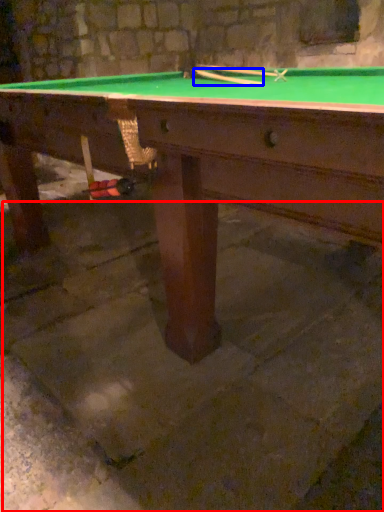
Question: Which of the following is the closest to the observer, concrete (highlighted by a red box) or cue (highlighted by a blue box)?

Choices:
 (A) concrete
 (B) cue

Answer: (A)